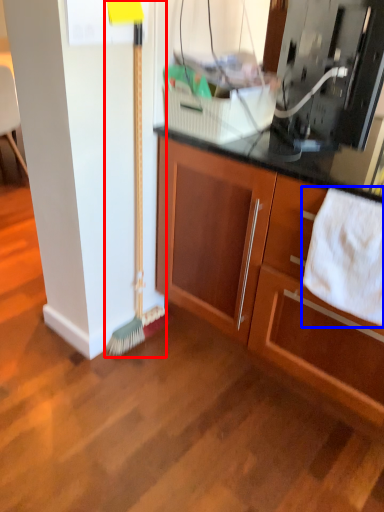
Question: Which object appears farthest to the camera in this image, brush (highlighted by a red box) or bath towel (highlighted by a blue box)?

Choices:
 (A) brush
 (B) bath towel

Answer: (A)